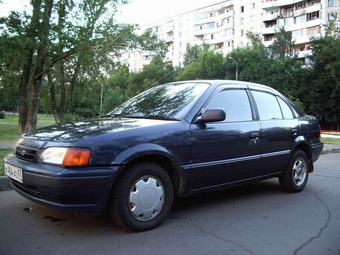
Where is `mirror`? Image resolution: width=340 pixels, height=255 pixels. mirror is located at coordinates (216, 120).